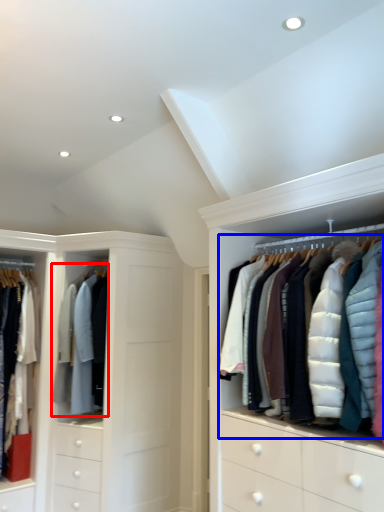
Question: Which object appears farthest to the camera in this image, clothing (highlighted by a red box) or garment (highlighted by a blue box)?

Choices:
 (A) clothing
 (B) garment

Answer: (A)